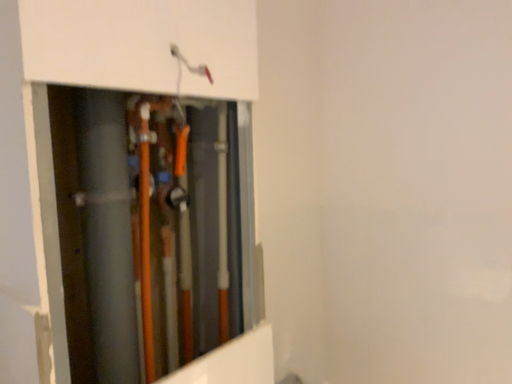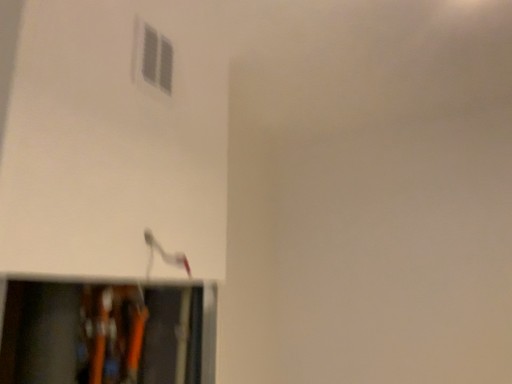
Question: Which way did the camera rotate in the video?

Choices:
 (A) rotated upward
 (B) rotated downward

Answer: (A)